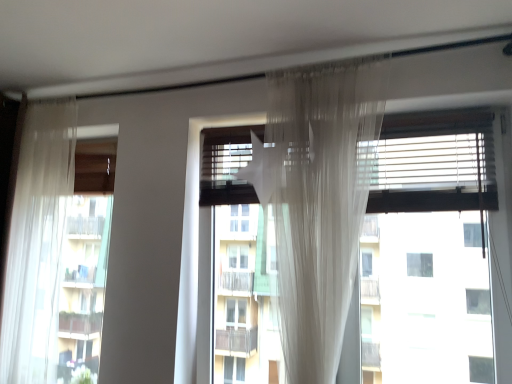
What is the approximate width of transparent fabric at center?

It is 2.02 inches.

Measure the distance between transparent fabric at center and camera.

They are 1.75 meters apart.

What do you see at coordinates (429, 252) in the screenshot? I see `transparent fabric at center` at bounding box center [429, 252].

You are a GUI agent. You are given a task and a screenshot of the screen. Output one action in this format:
    pyautogui.click(x=<x>, y=<y>)
    Task: Click on the transparent fabric at center
    Image resolution: width=512 pixels, height=384 pixels.
    Given the screenshot: What is the action you would take?
    pyautogui.click(x=429, y=252)

Measure the distance between sheer white curtain at left and camera.

sheer white curtain at left and camera are 6.78 feet apart.

Find the location of a particular element. This screenshot has width=512, height=384. sheer white curtain at left is located at coordinates (37, 244).

This screenshot has height=384, width=512. What do you see at coordinates (37, 244) in the screenshot? I see `sheer white curtain at left` at bounding box center [37, 244].

Where is `transparent fabric at center`? The width and height of the screenshot is (512, 384). transparent fabric at center is located at coordinates pyautogui.click(x=429, y=252).

Is sheer white curtain at left at the right side of transparent fabric at center?

No, sheer white curtain at left is not to the right of transparent fabric at center.

Between sheer white curtain at left and transparent fabric at center, which one is positioned in front?

transparent fabric at center is closer to the camera.

Which point is more distant from viewer, (52, 304) or (456, 296)?

Positioned behind is point (52, 304).

From the image's perspective, is sheer white curtain at left positioned above or below transparent fabric at center?

Clearly, from the image's perspective, sheer white curtain at left is below transparent fabric at center.

From a real-world perspective, is sheer white curtain at left located beneath transparent fabric at center?

No.

Considering the sizes of objects sheer white curtain at left and transparent fabric at center in the image provided, who is thinner, sheer white curtain at left or transparent fabric at center?

transparent fabric at center is thinner.

Is sheer white curtain at left taller or shorter than transparent fabric at center?

Considering their sizes, sheer white curtain at left has more height than transparent fabric at center.

Can you confirm if sheer white curtain at left is smaller than transparent fabric at center?

Correct, sheer white curtain at left occupies less space than transparent fabric at center.

Would you say transparent fabric at center is part of sheer white curtain at left's contents?

No, sheer white curtain at left does not contain transparent fabric at center.

Is sheer white curtain at left with transparent fabric at center?

sheer white curtain at left and transparent fabric at center are clearly separated.

Is transparent fabric at center at the back of sheer white curtain at left?

sheer white curtain at left does not have its back to transparent fabric at center.

Find the location of `curtain below the transparent fabric at center (from the image's perspective)`. curtain below the transparent fabric at center (from the image's perspective) is located at coordinates (37, 244).

Is transparent fabric at center at the left side of sheer white curtain at left?

No.

Does transparent fabric at center come behind sheer white curtain at left?

No.

Considering the points (478, 124) and (33, 346), which point is behind, point (478, 124) or point (33, 346)?

Positioned behind is point (33, 346).

From the image's perspective, does transparent fabric at center appear higher than sheer white curtain at left?

Correct, transparent fabric at center appears higher than sheer white curtain at left in the image.

From a real-world perspective, which object stands above the other?

From a 3D spatial view, sheer white curtain at left is above.

Which object is thinner, transparent fabric at center or sheer white curtain at left?

transparent fabric at center.

Considering the relative sizes of transparent fabric at center and sheer white curtain at left in the image provided, is transparent fabric at center taller than sheer white curtain at left?

In fact, transparent fabric at center may be shorter than sheer white curtain at left.

Does transparent fabric at center have a larger size compared to sheer white curtain at left?

Yes, transparent fabric at center is bigger than sheer white curtain at left.

Is transparent fabric at center completely or partially outside of sheer white curtain at left?

Yes, transparent fabric at center is not within sheer white curtain at left.

Is transparent fabric at center next to sheer white curtain at left?

transparent fabric at center and sheer white curtain at left are not in contact.

Is transparent fabric at center facing towards sheer white curtain at left?

Yes, transparent fabric at center faces towards sheer white curtain at left.

Find the location of a particular element. Image resolution: width=512 pixels, height=384 pixels. curtain behind the transparent fabric at center is located at coordinates (37, 244).

You are a GUI agent. You are given a task and a screenshot of the screen. Output one action in this format:
    pyautogui.click(x=<x>, y=<y>)
    Task: Click on the window on the right of sheer white curtain at left
    
    Given the screenshot: What is the action you would take?
    pyautogui.click(x=429, y=252)

Find the location of a particular element. The image size is (512, 384). window that appears above the sheer white curtain at left (from the image's perspective) is located at coordinates (429, 252).